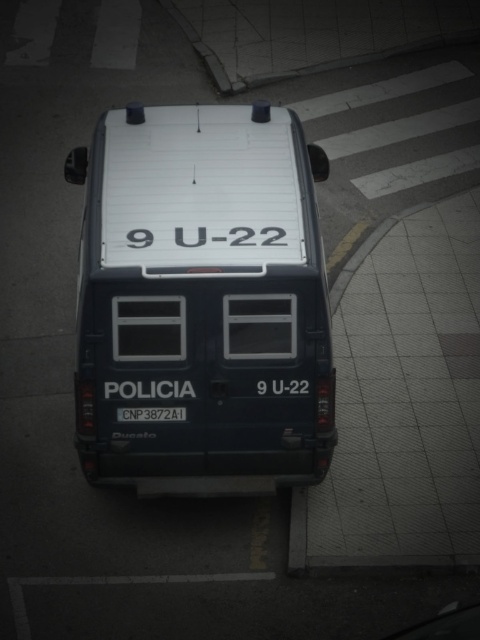
Is dark blue matte van at center bigger than white plastic text at center?

Correct, dark blue matte van at center is larger in size than white plastic text at center.

Does dark blue matte van at center appear on the left side of white plastic text at center?

Correct, you'll find dark blue matte van at center to the left of white plastic text at center.

You are a GUI agent. You are given a task and a screenshot of the screen. Output one action in this format:
    pyautogui.click(x=<x>, y=<y>)
    Task: Click on the dark blue matte van at center
    
    Given the screenshot: What is the action you would take?
    [202, 304]

Locate an element on the screen. This screenshot has width=480, height=640. dark blue matte van at center is located at coordinates (202, 304).

Which of these two, white plastic text at center or white plastic license plate at center, stands taller?

With more height is white plastic text at center.

Which is behind, point (215, 241) or point (168, 408)?

Positioned behind is point (168, 408).

Is point (275, 228) closer to camera compared to point (120, 408)?

That is True.

Find the location of a particular element. This screenshot has height=640, width=480. white plastic text at center is located at coordinates (232, 236).

Is dark blue matte van at center bigger than white plastic license plate at center?

Indeed, dark blue matte van at center has a larger size compared to white plastic license plate at center.

How far apart are dark blue matte van at center and white plastic license plate at center?

A distance of 1.10 meters exists between dark blue matte van at center and white plastic license plate at center.

Is point (228, 196) less distant than point (164, 408)?

No, (228, 196) is further to viewer.

Locate an element on the screen. dark blue matte van at center is located at coordinates (202, 304).